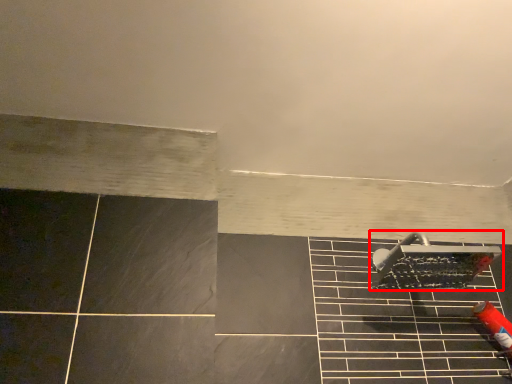
Question: From the image, what is the correct spatial relationship of shower (annotated by the red box) in relation to ceramic tile?

Choices:
 (A) right
 (B) left

Answer: (A)